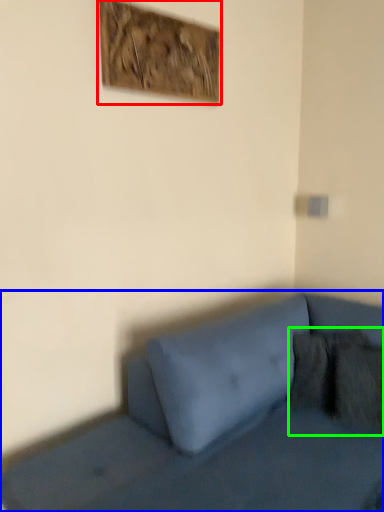
Question: Which object is the farthest from picture frame (highlighted by a red box)? Choose among these: studio couch (highlighted by a blue box) or pillow (highlighted by a green box).

Choices:
 (A) studio couch
 (B) pillow

Answer: (B)